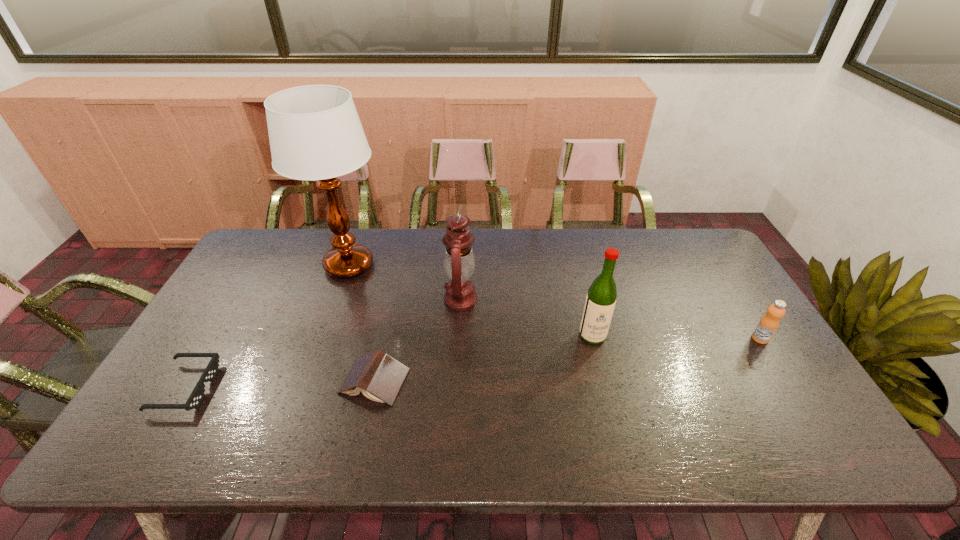
Where is `free space between the leftmost object and the rightmost object`? The width and height of the screenshot is (960, 540). free space between the leftmost object and the rightmost object is located at coordinates (472, 363).

Find the location of a particular element. This screenshot has height=540, width=960. unoccupied position between the table lamp and the shortest object is located at coordinates (267, 326).

Locate an element on the screen. free spot between the oil lamp and the sunglasses is located at coordinates (324, 343).

The image size is (960, 540). What are the coordinates of `free spot between the shortest object and the tallest object` in the screenshot? It's located at (267, 326).

Select which object is the third closest to the leftmost object. Please provide its 2D coordinates. Your answer should be formatted as a tuple, i.e. [(x, y)], where the tuple contains the x and y coordinates of a point satisfying the conditions above.

[(459, 263)]

Select which object appears as the fourth closest to the liquor. Please provide its 2D coordinates. Your answer should be formatted as a tuple, i.e. [(x, y)], where the tuple contains the x and y coordinates of a point satisfying the conditions above.

[(315, 133)]

The height and width of the screenshot is (540, 960). I want to click on free spot that satisfies the following two spatial constraints: 1. on the front label of the orange juice; 2. on the front-facing side of the leftmost object, so click(791, 388).